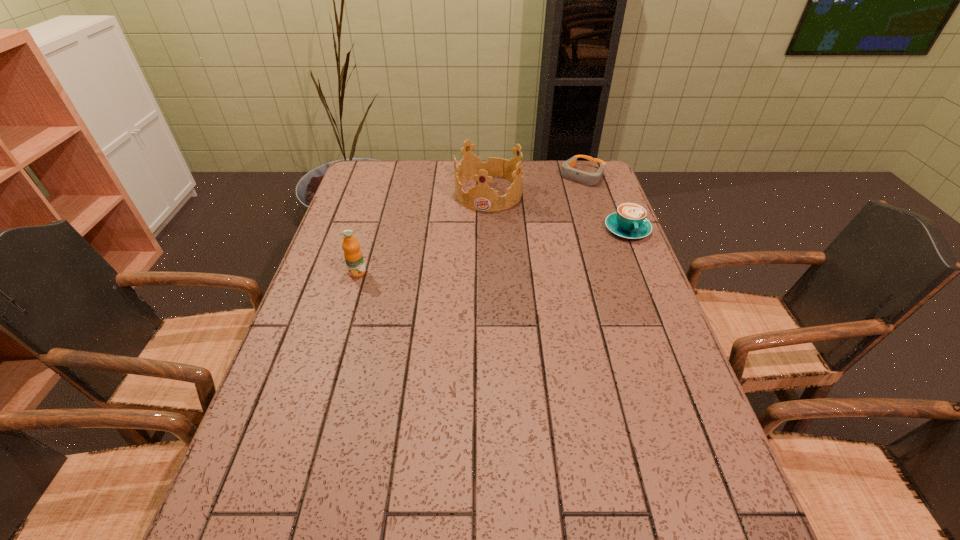
Locate an element on the screen. vacant space at the far edge of the desktop is located at coordinates (448, 190).

The height and width of the screenshot is (540, 960). I want to click on vacant space at the left edge, so click(x=359, y=218).

Identify the location of free space at the right edge of the desktop. (599, 267).

In the image, there is a desktop. Identify the location of free space at the far left corner. (379, 183).

In order to click on free space at the near left corner of the desktop in this screenshot , I will do `click(252, 485)`.

Where is `vacant space that's between the third object from right to left and the third tallest object`? vacant space that's between the third object from right to left and the third tallest object is located at coordinates (558, 211).

This screenshot has height=540, width=960. Find the location of `vacant region between the shortest object and the third object from right to left`. vacant region between the shortest object and the third object from right to left is located at coordinates (536, 185).

At what (x,y) coordinates should I click in order to perform the action: click on vacant area that lies between the second object from left to right and the shortest object. Please return your answer as a coordinate pair (x, y). This screenshot has height=540, width=960. Looking at the image, I should click on (536, 185).

Find the location of a particular element. The image size is (960, 540). vacant region between the shortest object and the leftmost object is located at coordinates (470, 225).

You are a GUI agent. You are given a task and a screenshot of the screen. Output one action in this format:
    pyautogui.click(x=<x>, y=<y>)
    Task: Click on the vacant region between the goggles and the orange juice
    
    Given the screenshot: What is the action you would take?
    pyautogui.click(x=470, y=225)